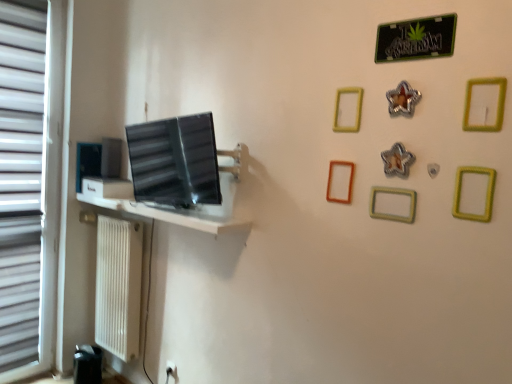
Question: Which is correct: white textured radiator at lower left is inside white plastic blind at left, or outside of it?

Choices:
 (A) outside
 (B) inside

Answer: (A)

Question: From a real-world perspective, relative to white plastic blind at left, is white textured radiator at lower left vertically above or below?

Choices:
 (A) above
 (B) below

Answer: (B)

Question: Which object is the farthest from the yellow matte picture frame at upper center, which is counted as the sixth picture frame, starting from the front?

Choices:
 (A) brown matte picture frame at center-right, acting as the 7th picture frame starting from the right
 (B) white plastic electric outlet at lower left
 (C) green matte picture frame at upper right, which is the first picture frame in front-to-back order
 (D) yellow matte picture frame at upper right, the seventh picture frame in the back-to-front sequence
 (E) silver metallic star at upper center, arranged as the sixth picture frame when viewed from the back

Answer: (B)

Question: Considering the real-world distances, which object is closest to the yellow matte picture frame at upper right, which is counted as the seventh picture frame, starting from the left?

Choices:
 (A) green matte picture frame at upper right, which is the first picture frame in front-to-back order
 (B) green metallic sign at upper right
 (C) satin black monitor at center
 (D) white plastic blind at left
 (E) matte black picture frame at left, the 1th picture frame from the left

Answer: (A)